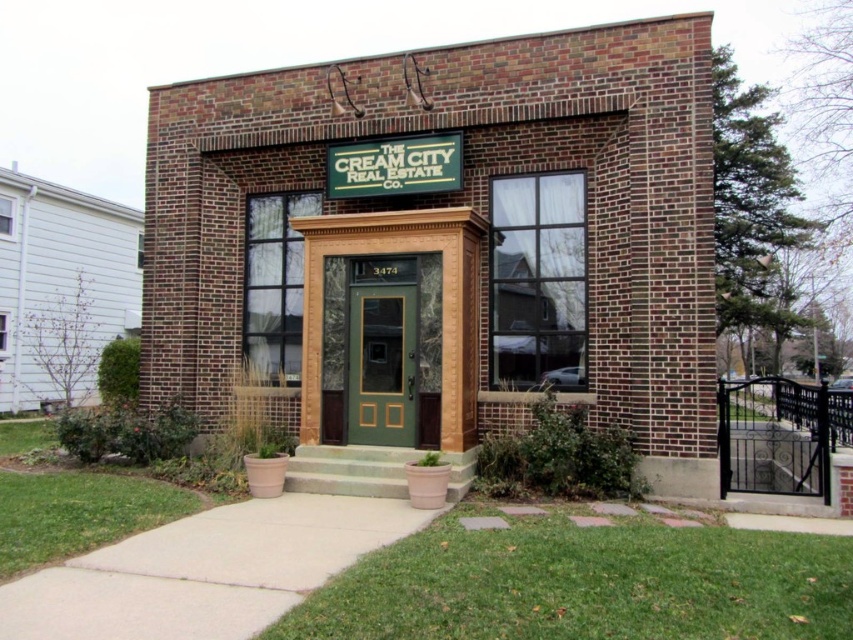
Who is more distant from viewer, (372, 310) or (396, 380)?

The point (372, 310) is more distant.

Where is `green marble door at center`? The image size is (853, 640). green marble door at center is located at coordinates (381, 349).

Who is more distant from viewer, (x=433, y=362) or (x=347, y=332)?

The point (x=347, y=332) is more distant.

Find the location of `green marble door at center`. green marble door at center is located at coordinates (381, 349).